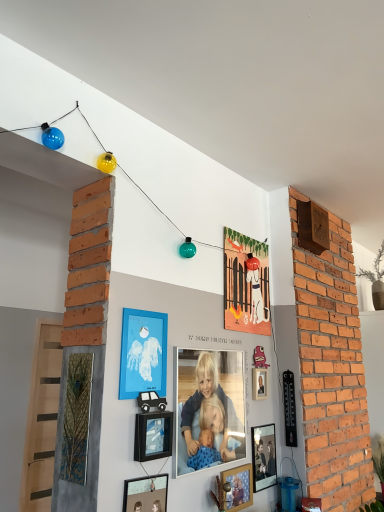
The width and height of the screenshot is (384, 512). What do you see at coordinates (246, 284) in the screenshot?
I see `matte paper picture frame at upper center, the sixth picture frame when ordered from front to back` at bounding box center [246, 284].

The height and width of the screenshot is (512, 384). What do you see at coordinates (238, 487) in the screenshot? I see `wooden photo frame at lower center, placed as the third picture frame when sorted from back to front` at bounding box center [238, 487].

This screenshot has height=512, width=384. What do you see at coordinates (211, 403) in the screenshot?
I see `smooth wooden frame at center` at bounding box center [211, 403].

What is the approximate height of matte black picture frame at center, the second picture frame positioned from the back?

The height of matte black picture frame at center, the second picture frame positioned from the back, is 12.29 inches.

The width and height of the screenshot is (384, 512). I want to click on matte blue frame at center, which ranks as the 4th picture frame in back-to-front order, so click(143, 353).

The image size is (384, 512). Describe the element at coordinates (372, 282) in the screenshot. I see `green leafy plant at upper right` at that location.

How much space does matte black picture frame at lower center, arranged as the 1th picture frame when viewed from the front, occupy horizontally?

2.06 centimeters.

The height and width of the screenshot is (512, 384). What are the coordinates of `matte paper picture frame at upper center, the sixth picture frame when ordered from front to back` in the screenshot? It's located at (246, 284).

From a real-world perspective, is black matte picture frame at center, the 5th picture frame from the back, physically located above or below smooth wooden frame at center?

black matte picture frame at center, the 5th picture frame from the back, is below smooth wooden frame at center.

Which is more to the left, black matte picture frame at center, the 5th picture frame from the back, or smooth wooden frame at center?

Positioned to the left is black matte picture frame at center, the 5th picture frame from the back.

Who is bigger, black matte picture frame at center, arranged as the 2th picture frame when viewed from the front, or smooth wooden frame at center?

With larger size is smooth wooden frame at center.

Is black matte picture frame at center, arranged as the 2th picture frame when viewed from the front, turned away from smooth wooden frame at center?

No, black matte picture frame at center, arranged as the 2th picture frame when viewed from the front, is not facing away from smooth wooden frame at center.

Is matte black picture frame at lower center, acting as the sixth picture frame starting from the back, aimed at green leafy plant at upper right?

No, matte black picture frame at lower center, acting as the sixth picture frame starting from the back, is not facing towards green leafy plant at upper right.

Would you say matte black picture frame at lower center, acting as the sixth picture frame starting from the back, is inside or outside green leafy plant at upper right?

matte black picture frame at lower center, acting as the sixth picture frame starting from the back, is not inside green leafy plant at upper right, it's outside.

Which is behind, matte black picture frame at lower center, acting as the sixth picture frame starting from the back, or green leafy plant at upper right?

green leafy plant at upper right is more distant.

Does matte black picture frame at lower center, acting as the sixth picture frame starting from the back, appear on the left side of green leafy plant at upper right?

Yes.

Considering the relative sizes of matte blue frame at center, which is the 3th picture frame from front to back, and green leafy plant at upper right in the image provided, is matte blue frame at center, which is the 3th picture frame from front to back, wider than green leafy plant at upper right?

No.

From a real-world perspective, is matte blue frame at center, which is the 3th picture frame from front to back, physically below green leafy plant at upper right?

Yes, from a real-world perspective, matte blue frame at center, which is the 3th picture frame from front to back, is beneath green leafy plant at upper right.

Considering the relative positions of matte blue frame at center, which is the 3th picture frame from front to back, and green leafy plant at upper right in the image provided, is matte blue frame at center, which is the 3th picture frame from front to back, in front of green leafy plant at upper right?

Yes, matte blue frame at center, which is the 3th picture frame from front to back, is in front of green leafy plant at upper right.

Considering the relative positions of wooden photo frame at lower center, placed as the third picture frame when sorted from back to front, and matte black picture frame at lower center, acting as the sixth picture frame starting from the back, in the image provided, is wooden photo frame at lower center, placed as the third picture frame when sorted from back to front, in front of matte black picture frame at lower center, acting as the sixth picture frame starting from the back,?

No, the depth of wooden photo frame at lower center, placed as the third picture frame when sorted from back to front, is greater than that of matte black picture frame at lower center, acting as the sixth picture frame starting from the back.

From the image's perspective, which is below, wooden photo frame at lower center, marked as the fourth picture frame in a front-to-back arrangement, or matte black picture frame at lower center, arranged as the 1th picture frame when viewed from the front?

wooden photo frame at lower center, marked as the fourth picture frame in a front-to-back arrangement, is shown below in the image.

From the picture: Which of these two, wooden photo frame at lower center, placed as the third picture frame when sorted from back to front, or matte black picture frame at lower center, acting as the sixth picture frame starting from the back, stands taller?

With more height is matte black picture frame at lower center, acting as the sixth picture frame starting from the back.

Does smooth wooden frame at center touch matte blue frame at center, which ranks as the 4th picture frame in back-to-front order?

No, smooth wooden frame at center is not in contact with matte blue frame at center, which ranks as the 4th picture frame in back-to-front order.

Looking at this image, measure the distance from smooth wooden frame at center to matte blue frame at center, which is the 3th picture frame from front to back.

smooth wooden frame at center is 10.85 inches from matte blue frame at center, which is the 3th picture frame from front to back.

Is smooth wooden frame at center facing towards matte blue frame at center, which is the 3th picture frame from front to back?

No, smooth wooden frame at center does not turn towards matte blue frame at center, which is the 3th picture frame from front to back.

Who is smaller, smooth wooden frame at center or matte blue frame at center, which is the 3th picture frame from front to back?

Smaller between the two is matte blue frame at center, which is the 3th picture frame from front to back.

Is matte black picture frame at center, the 5th picture frame positioned from the front, closer to the viewer compared to green leafy plant at upper right?

Yes, matte black picture frame at center, the 5th picture frame positioned from the front, is in front of green leafy plant at upper right.

Could you tell me if matte black picture frame at center, the 5th picture frame positioned from the front, is facing green leafy plant at upper right?

No.

Based on their positions, is matte black picture frame at center, the 5th picture frame positioned from the front, located to the left or right of green leafy plant at upper right?

matte black picture frame at center, the 5th picture frame positioned from the front, is positioned on green leafy plant at upper right's left side.

From the picture: Which point is more distant from viewer, (267, 445) or (382, 259)?

The point (382, 259) is farther.

In terms of width, does wooden photo frame at lower center, placed as the third picture frame when sorted from back to front, look wider or thinner when compared to green leafy plant at upper right?

Considering their sizes, wooden photo frame at lower center, placed as the third picture frame when sorted from back to front, looks slimmer than green leafy plant at upper right.

I want to click on the 3rd picture frame in front of the green leafy plant at upper right, so point(238,487).

Which point is more distant from viewer, [242,493] or [381,296]?

Point [381,296]

Is wooden photo frame at lower center, placed as the third picture frame when sorted from back to front, far from green leafy plant at upper right?

Yes.

I want to click on person above the black matte picture frame at center, arranged as the 2th picture frame when viewed from the front (from a real-world perspective), so click(211, 403).

At what (x,y) coordinates should I click in order to perform the action: click on the 6th picture frame directly beneath the green leafy plant at upper right (from a real-world perspective). Please return your answer as a coordinate pair (x, y). The image size is (384, 512). Looking at the image, I should click on (146, 494).

Estimate the real-world distances between objects in this image. Which object is closer to smooth wooden frame at center, matte black picture frame at lower center, arranged as the 1th picture frame when viewed from the front, or matte blue frame at center, which is the 3th picture frame from front to back?

matte blue frame at center, which is the 3th picture frame from front to back, is positioned closer to the anchor smooth wooden frame at center.

When comparing their distances from wooden photo frame at lower center, marked as the fourth picture frame in a front-to-back arrangement, does matte blue frame at center, which ranks as the 4th picture frame in back-to-front order, or matte black picture frame at center, the 5th picture frame positioned from the front, seem further?

matte blue frame at center, which ranks as the 4th picture frame in back-to-front order.

Estimate the real-world distances between objects in this image. Which object is closer to matte blue frame at center, which is the 3th picture frame from front to back, green leafy plant at upper right or matte black picture frame at center, the second picture frame positioned from the back?

matte black picture frame at center, the second picture frame positioned from the back, is closer to matte blue frame at center, which is the 3th picture frame from front to back.

Looking at the image, which one is located further to wooden photo frame at lower center, marked as the fourth picture frame in a front-to-back arrangement, matte paper picture frame at upper center, the sixth picture frame when ordered from front to back, or matte blue frame at center, which is the 3th picture frame from front to back?

The object further to wooden photo frame at lower center, marked as the fourth picture frame in a front-to-back arrangement, is matte paper picture frame at upper center, the sixth picture frame when ordered from front to back.

Looking at the image, which one is located further to green leafy plant at upper right, matte paper picture frame at upper center, acting as the first picture frame starting from the back, or wooden photo frame at lower center, placed as the third picture frame when sorted from back to front?

wooden photo frame at lower center, placed as the third picture frame when sorted from back to front.

Looking at the image, which one is located closer to matte paper picture frame at upper center, the sixth picture frame when ordered from front to back, matte black picture frame at lower center, acting as the sixth picture frame starting from the back, or matte black picture frame at center, the 5th picture frame positioned from the front?

matte black picture frame at center, the 5th picture frame positioned from the front, lies closer to matte paper picture frame at upper center, the sixth picture frame when ordered from front to back, than the other object.

Estimate the real-world distances between objects in this image. Which object is closer to matte blue frame at center, which is the 3th picture frame from front to back, green leafy plant at upper right or matte paper picture frame at upper center, acting as the first picture frame starting from the back?

Among the two, matte paper picture frame at upper center, acting as the first picture frame starting from the back, is located nearer to matte blue frame at center, which is the 3th picture frame from front to back.

Based on their spatial positions, is matte blue frame at center, which is the 3th picture frame from front to back, or black matte picture frame at center, the 5th picture frame from the back, further from green leafy plant at upper right?

Among the two, black matte picture frame at center, the 5th picture frame from the back, is located further to green leafy plant at upper right.

At what (x,y) coordinates should I click in order to perform the action: click on person between black matte picture frame at center, the 5th picture frame from the back, and matte paper picture frame at upper center, the sixth picture frame when ordered from front to back, from front to back. Please return your answer as a coordinate pair (x, y). This screenshot has width=384, height=512. Looking at the image, I should click on (211, 403).

The image size is (384, 512). I want to click on person between black matte picture frame at center, arranged as the 2th picture frame when viewed from the front, and matte black picture frame at center, the 5th picture frame positioned from the front, along the z-axis, so click(x=211, y=403).

Identify the location of picture frame between matte paper picture frame at upper center, acting as the first picture frame starting from the back, and green leafy plant at upper right, in the horizontal direction. (264, 457).

Identify the location of person between matte blue frame at center, which is the 3th picture frame from front to back, and matte paper picture frame at upper center, acting as the first picture frame starting from the back, from front to back. This screenshot has height=512, width=384. (211, 403).